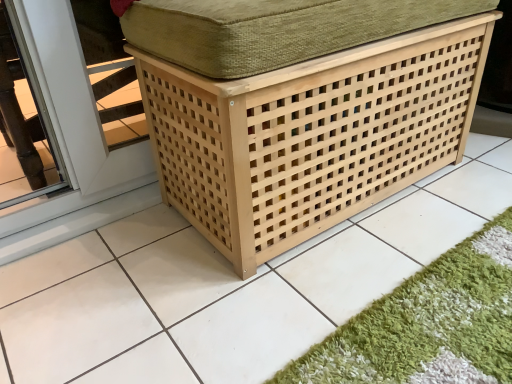
Locate an element on the screen. vacant space to the left of green shaggy bath mat at lower right is located at coordinates (218, 299).